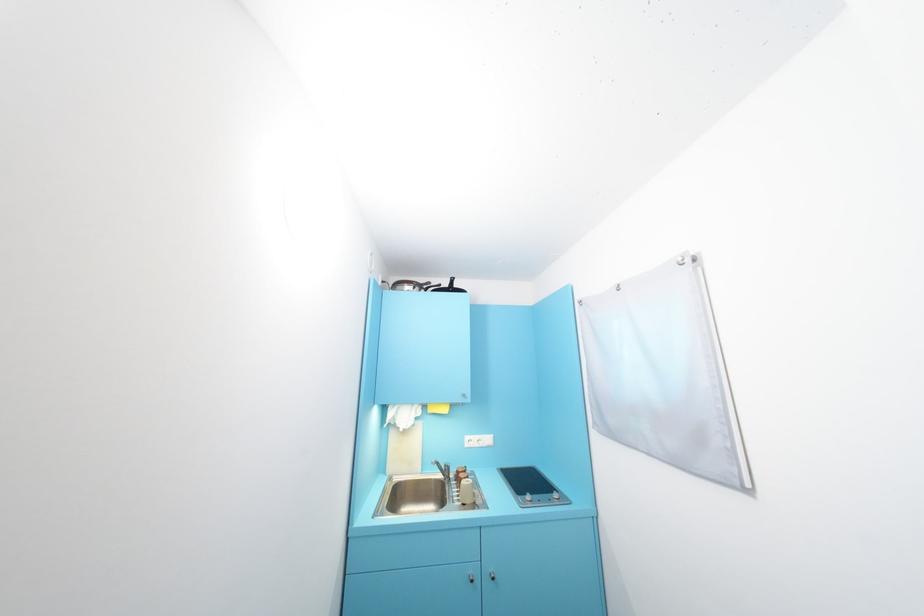
Locate an element on the screen. Image resolution: width=924 pixels, height=616 pixels. black pan handle is located at coordinates (448, 286).